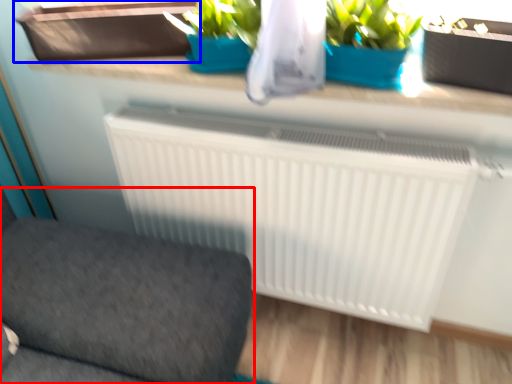
Question: Which object is further to the camera taking this photo, furniture (highlighted by a red box) or window box (highlighted by a blue box)?

Choices:
 (A) furniture
 (B) window box

Answer: (B)